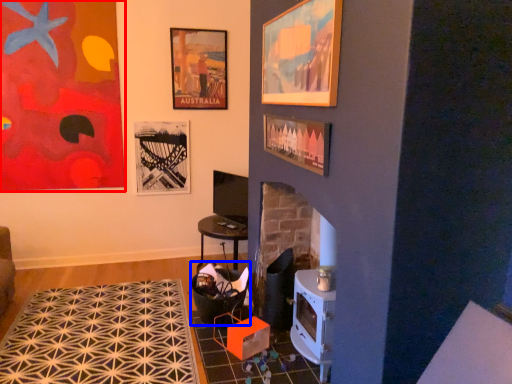
Question: Which object is closer to the camera taking this photo, picture frame (highlighted by a red box) or rocking chair (highlighted by a blue box)?

Choices:
 (A) picture frame
 (B) rocking chair

Answer: (B)